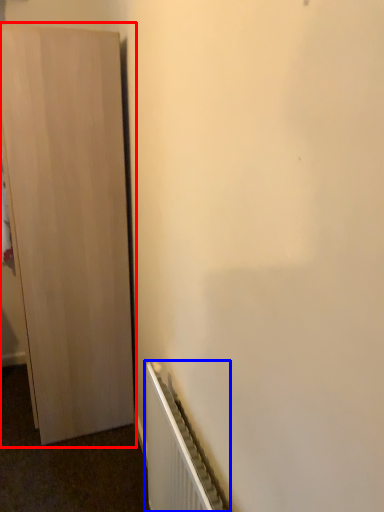
Question: Among these objects, which one is nearest to the camera, cupboard (highlighted by a red box) or radiator (highlighted by a blue box)?

Choices:
 (A) cupboard
 (B) radiator

Answer: (B)